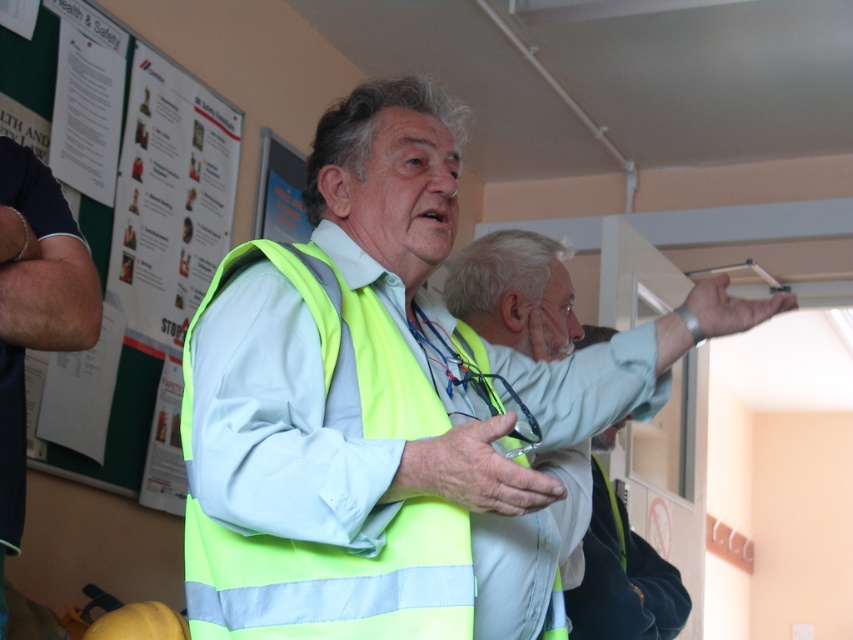
Based on the photo, does neon yellow reflective vest at center appear under green reflective vest at left?

Correct, neon yellow reflective vest at center is located below green reflective vest at left.

Is point (427, 532) farther from camera compared to point (158, 56)?

That is False.

At what (x,y) coordinates should I click in order to perform the action: click on neon yellow reflective vest at center. Please return your answer as a coordinate pair (x, y). Image resolution: width=853 pixels, height=640 pixels. Looking at the image, I should click on (331, 580).

From the picture: Between green reflective vest at left and yellow reflective vest at center, which one is positioned higher?

green reflective vest at left is above.

Consider the image. Does green reflective vest at left appear over yellow reflective vest at center?

Correct, green reflective vest at left is located above yellow reflective vest at center.

Is point (42, 10) in front of point (593, 513)?

No.

Where is `green reflective vest at left`? green reflective vest at left is located at coordinates (154, 246).

Can you confirm if neon yellow reflective vest at center is positioned to the right of yellow reflective vest at center?

No, neon yellow reflective vest at center is not to the right of yellow reflective vest at center.

Between neon yellow reflective vest at center and yellow reflective vest at center, which one is positioned higher?

neon yellow reflective vest at center is above.

Between point (219, 538) and point (579, 634), which one is positioned in front?

Point (219, 538)

I want to click on neon yellow reflective vest at center, so click(x=331, y=580).